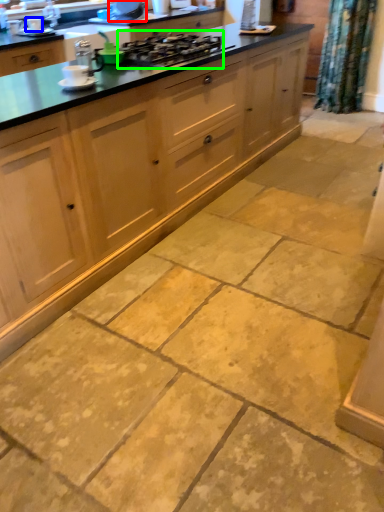
Question: Based on their relative distances, which object is nearer to appliance (highlighted by a red box)? Choose from appliance (highlighted by a blue box) and gas stove (highlighted by a green box).

Choices:
 (A) appliance
 (B) gas stove

Answer: (A)